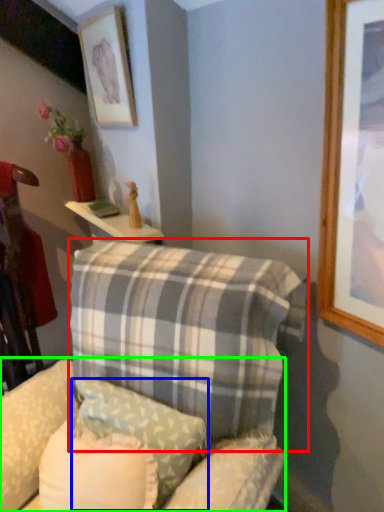
Question: Considering the real-world distances, which object is closest to pillow (highlighted by a red box)? pillow (highlighted by a blue box) or swivel chair (highlighted by a green box).

Choices:
 (A) pillow
 (B) swivel chair

Answer: (A)